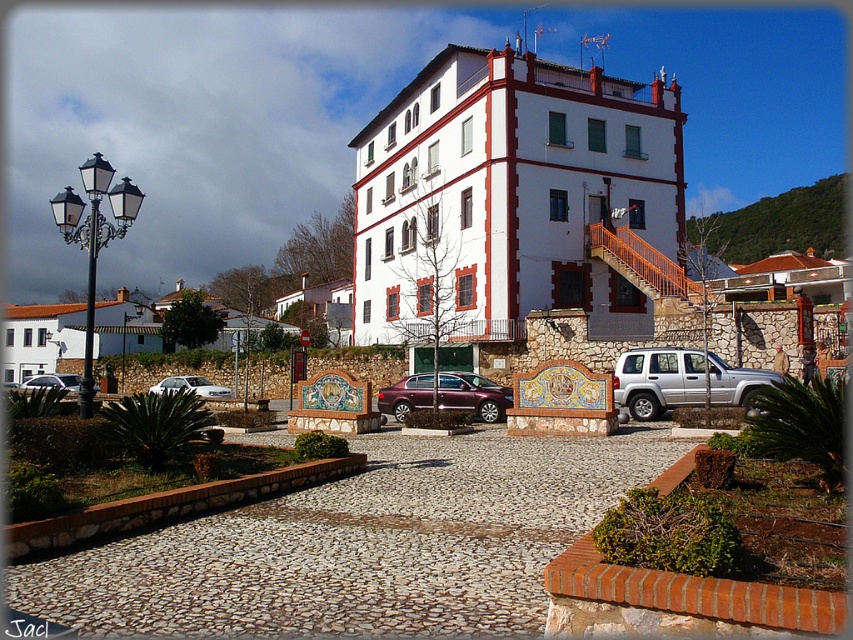
Is point (643, 374) positioned behind point (389, 412)?

That is False.

Can you confirm if silver metallic suv at right is shorter than matte maroon sedan at center?

Incorrect, silver metallic suv at right's height does not fall short of matte maroon sedan at center's.

Where is `silver metallic suv at right`? silver metallic suv at right is located at coordinates (682, 380).

Is silver metallic suv at right below silver metallic sedan at center?

No.

Looking at this image, between silver metallic suv at right and silver metallic sedan at center, which one is positioned higher?

silver metallic suv at right is higher up.

This screenshot has width=853, height=640. I want to click on silver metallic suv at right, so click(682, 380).

Which is below, matte maroon sedan at center or white glossy sedan at lower left?

white glossy sedan at lower left is lower down.

Is point (409, 410) positioned in front of point (160, 384)?

That is True.

The height and width of the screenshot is (640, 853). Find the location of `matte maroon sedan at center`. matte maroon sedan at center is located at coordinates (473, 396).